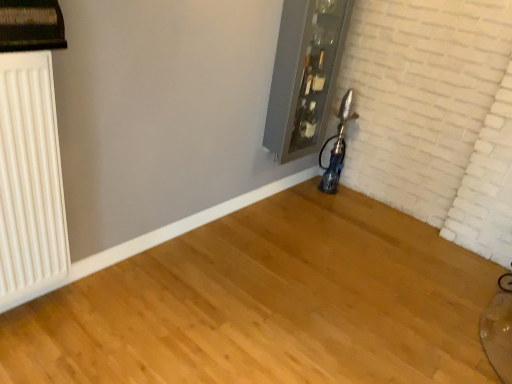
Question: Is white matte radiator at left inside or outside of metallic glass at upper center?

Choices:
 (A) outside
 (B) inside

Answer: (A)

Question: Looking at their shapes, would you say white matte radiator at left is wider or thinner than metallic glass at upper center?

Choices:
 (A) wide
 (B) thin

Answer: (B)

Question: Is white matte radiator at left to the left or to the right of metallic glass at upper center in the image?

Choices:
 (A) right
 (B) left

Answer: (B)

Question: Considering the positions of metallic glass at upper center and white matte radiator at left in the image, is metallic glass at upper center bigger or smaller than white matte radiator at left?

Choices:
 (A) big
 (B) small

Answer: (A)

Question: Considering the positions of point tap(321, 124) and point tap(62, 240), is point tap(321, 124) closer or farther from the camera than point tap(62, 240)?

Choices:
 (A) closer
 (B) farther

Answer: (B)

Question: In the image, is metallic glass at upper center on the left side or the right side of white matte radiator at left?

Choices:
 (A) right
 (B) left

Answer: (A)

Question: From the image's perspective, is metallic glass at upper center above or below white matte radiator at left?

Choices:
 (A) below
 (B) above

Answer: (B)